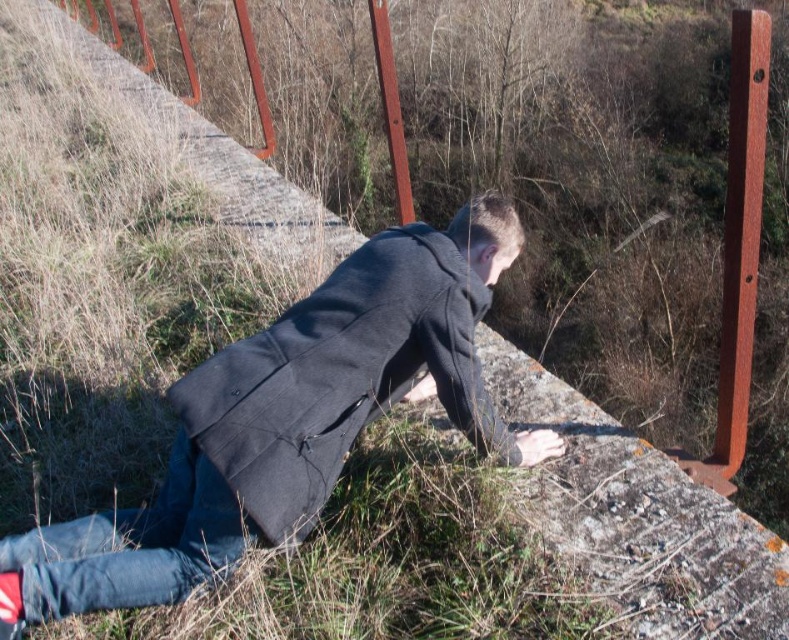
You are a rescue worker trying to locate the dark gray matte sweatshirt at center and the rusty metal pole at upper center in the scene. Based on the spatial relationship between them, which object is positioned higher from the ground?

The rusty metal pole at upper center is positioned higher from the ground than the dark gray matte sweatshirt at center.